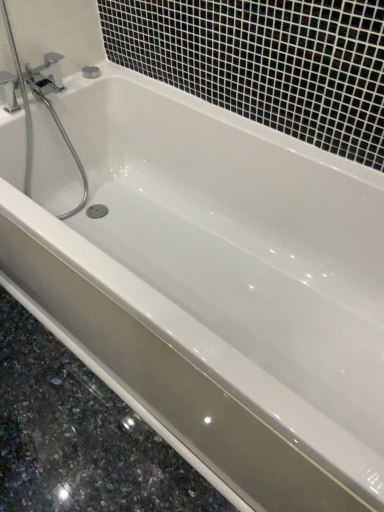
Where is `empty space that is ontop of white glossy ledge at lower center (from a real-world perspective)`? The image size is (384, 512). empty space that is ontop of white glossy ledge at lower center (from a real-world perspective) is located at coordinates (72, 412).